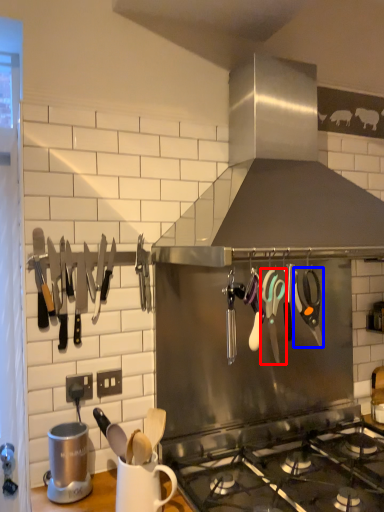
Question: Which object appears closest to the camera in this image, scissors (highlighted by a red box) or scissors (highlighted by a blue box)?

Choices:
 (A) scissors
 (B) scissors

Answer: (A)